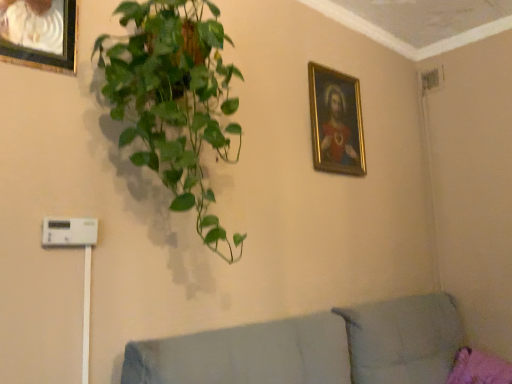
Describe the element at coordinates (39, 34) in the screenshot. I see `brushed metal picture frame at upper left, which appears as the first picture frame when viewed from the front` at that location.

What are the coordinates of `brushed metal picture frame at upper left, which appears as the first picture frame when viewed from the front` in the screenshot? It's located at (39, 34).

Measure the distance between gold-framed painting at upper right, acting as the second picture frame starting from the front, and camera.

They are 2.07 meters apart.

The width and height of the screenshot is (512, 384). Describe the element at coordinates (69, 232) in the screenshot. I see `white plastic light switch at lower left` at that location.

At what (x,y) coordinates should I click in order to perform the action: click on white plastic light switch at lower left. Please return your answer as a coordinate pair (x, y). Image resolution: width=512 pixels, height=384 pixels. Looking at the image, I should click on (69, 232).

You are a GUI agent. You are given a task and a screenshot of the screen. Output one action in this format:
    pyautogui.click(x=<x>, y=<y>)
    Task: Click on the brushed metal picture frame at upper left, which ranks as the second picture frame in back-to-front order
    
    Given the screenshot: What is the action you would take?
    pyautogui.click(x=39, y=34)

Is light gray fabric couch at lower right at the back of white plastic light switch at lower left?

No, white plastic light switch at lower left is not facing the opposite direction of light gray fabric couch at lower right.

Based on their sizes in the image, would you say white plastic light switch at lower left is bigger or smaller than light gray fabric couch at lower right?

In the image, white plastic light switch at lower left appears to be smaller than light gray fabric couch at lower right.

Can you confirm if white plastic light switch at lower left is positioned to the left of light gray fabric couch at lower right?

Yes, white plastic light switch at lower left is to the left of light gray fabric couch at lower right.

Looking at this image, is white plastic light switch at lower left directly adjacent to light gray fabric couch at lower right?

No, white plastic light switch at lower left is not with light gray fabric couch at lower right.

Between green glossy plant at upper left and brushed metal picture frame at upper left, which ranks as the second picture frame in back-to-front order, which one is positioned behind?

brushed metal picture frame at upper left, which ranks as the second picture frame in back-to-front order, is more distant.

Is green glossy plant at upper left aimed at brushed metal picture frame at upper left, which ranks as the second picture frame in back-to-front order?

No, green glossy plant at upper left is not aimed at brushed metal picture frame at upper left, which ranks as the second picture frame in back-to-front order.

From a real-world perspective, which object stands above the other?

brushed metal picture frame at upper left, positioned as the second picture frame in right-to-left order.

From the image's perspective, is brushed metal picture frame at upper left, which appears as the first picture frame when viewed from the left, on light gray fabric couch at lower right?

Correct, brushed metal picture frame at upper left, which appears as the first picture frame when viewed from the left, appears higher than light gray fabric couch at lower right in the image.

Which of these two, brushed metal picture frame at upper left, which appears as the first picture frame when viewed from the front, or light gray fabric couch at lower right, is bigger?

With larger size is light gray fabric couch at lower right.

Where is `studio couch located below the brushed metal picture frame at upper left, which appears as the first picture frame when viewed from the front (from the image's perspective)`? studio couch located below the brushed metal picture frame at upper left, which appears as the first picture frame when viewed from the front (from the image's perspective) is located at coordinates (323, 349).

From a real-world perspective, does brushed metal picture frame at upper left, positioned as the second picture frame in right-to-left order, sit lower than light gray fabric couch at lower right?

No, from a real-world perspective, brushed metal picture frame at upper left, positioned as the second picture frame in right-to-left order, is not below light gray fabric couch at lower right.

Which of these two, brushed metal picture frame at upper left, which appears as the first picture frame when viewed from the front, or white plastic light switch at lower left, stands taller?

brushed metal picture frame at upper left, which appears as the first picture frame when viewed from the front.

Does brushed metal picture frame at upper left, which appears as the first picture frame when viewed from the front, appear on the right side of white plastic light switch at lower left?

No.

How much distance is there between brushed metal picture frame at upper left, positioned as the second picture frame in right-to-left order, and white plastic light switch at lower left?

21.84 inches.

Based on the photo, from a real-world perspective, is brushed metal picture frame at upper left, positioned as the second picture frame in right-to-left order, under white plastic light switch at lower left?

No.

Find the location of `studio couch lying in front of the white plastic light switch at lower left`. studio couch lying in front of the white plastic light switch at lower left is located at coordinates (323, 349).

From a real-world perspective, which object rests below the other?

In real-world perspective, light gray fabric couch at lower right is lower.

Considering the sizes of objects light gray fabric couch at lower right and white plastic light switch at lower left in the image provided, who is thinner, light gray fabric couch at lower right or white plastic light switch at lower left?

With smaller width is white plastic light switch at lower left.

Between light gray fabric couch at lower right and white plastic light switch at lower left, which one appears on the right side from the viewer's perspective?

Positioned to the right is light gray fabric couch at lower right.

Based on their positions, is white plastic light switch at lower left located to the left or right of gold-framed painting at upper right, the first picture frame in the right-to-left sequence?

In the image, white plastic light switch at lower left appears on the left side of gold-framed painting at upper right, the first picture frame in the right-to-left sequence.

Measure the distance from white plastic light switch at lower left to gold-framed painting at upper right, which is the 2th picture frame from left to right.

white plastic light switch at lower left is 4.38 feet away from gold-framed painting at upper right, which is the 2th picture frame from left to right.

Is point (92, 242) closer to viewer compared to point (316, 74)?

Yes, point (92, 242) is in front of point (316, 74).

Can you see white plastic light switch at lower left touching gold-framed painting at upper right, the first picture frame when ordered from back to front?

No, white plastic light switch at lower left is not touching gold-framed painting at upper right, the first picture frame when ordered from back to front.

Is white plastic light switch at lower left to the left of brushed metal picture frame at upper left, which appears as the first picture frame when viewed from the front, from the viewer's perspective?

Incorrect, white plastic light switch at lower left is not on the left side of brushed metal picture frame at upper left, which appears as the first picture frame when viewed from the front.

Is white plastic light switch at lower left located outside brushed metal picture frame at upper left, which appears as the first picture frame when viewed from the left?

Indeed, white plastic light switch at lower left is completely outside brushed metal picture frame at upper left, which appears as the first picture frame when viewed from the left.

Is white plastic light switch at lower left oriented towards brushed metal picture frame at upper left, which appears as the first picture frame when viewed from the front?

No, white plastic light switch at lower left is not aimed at brushed metal picture frame at upper left, which appears as the first picture frame when viewed from the front.

Is the depth of white plastic light switch at lower left less than that of brushed metal picture frame at upper left, positioned as the second picture frame in right-to-left order?

No, it is not.

The image size is (512, 384). Identify the location of studio couch in front of the white plastic light switch at lower left. (323, 349).

From a real-world perspective, count 2nd picture frames upward from the green glossy plant at upper left and point to it. Please provide its 2D coordinates.

[(39, 34)]

Considering their positions, is light gray fabric couch at lower right positioned further to gold-framed painting at upper right, acting as the second picture frame starting from the front, than white plastic light switch at lower left?

white plastic light switch at lower left lies further to gold-framed painting at upper right, acting as the second picture frame starting from the front, than the other object.

Considering their positions, is brushed metal picture frame at upper left, which ranks as the second picture frame in back-to-front order, positioned further to white plastic light switch at lower left than green glossy plant at upper left?

brushed metal picture frame at upper left, which ranks as the second picture frame in back-to-front order, lies further to white plastic light switch at lower left than the other object.

Looking at the image, which one is located closer to white plastic light switch at lower left, brushed metal picture frame at upper left, which ranks as the second picture frame in back-to-front order, or gold-framed painting at upper right, which is the 2th picture frame from left to right?

brushed metal picture frame at upper left, which ranks as the second picture frame in back-to-front order.

Estimate the real-world distances between objects in this image. Which object is closer to white plastic light switch at lower left, light gray fabric couch at lower right or green glossy plant at upper left?

green glossy plant at upper left is closer to white plastic light switch at lower left.

Considering their positions, is brushed metal picture frame at upper left, positioned as the second picture frame in right-to-left order, positioned closer to gold-framed painting at upper right, the first picture frame in the right-to-left sequence, than green glossy plant at upper left?

green glossy plant at upper left is positioned closer to the anchor gold-framed painting at upper right, the first picture frame in the right-to-left sequence.

From the image, which object appears to be nearer to green glossy plant at upper left, light gray fabric couch at lower right or white plastic light switch at lower left?

white plastic light switch at lower left is positioned closer to the anchor green glossy plant at upper left.

When comparing their distances from gold-framed painting at upper right, the first picture frame in the right-to-left sequence, does green glossy plant at upper left or light gray fabric couch at lower right seem closer?

Based on the image, green glossy plant at upper left appears to be nearer to gold-framed painting at upper right, the first picture frame in the right-to-left sequence.

Looking at the image, which one is located further to light gray fabric couch at lower right, brushed metal picture frame at upper left, which appears as the first picture frame when viewed from the front, or green glossy plant at upper left?

Among the two, brushed metal picture frame at upper left, which appears as the first picture frame when viewed from the front, is located further to light gray fabric couch at lower right.

Identify the location of houseplant located between white plastic light switch at lower left and light gray fabric couch at lower right in the left-right direction. This screenshot has width=512, height=384. (174, 100).

You are a GUI agent. You are given a task and a screenshot of the screen. Output one action in this format:
    pyautogui.click(x=<x>, y=<y>)
    Task: Click on the light switch between light gray fabric couch at lower right and gold-framed painting at upper right, which is the 2th picture frame from left to right, along the z-axis
    
    Given the screenshot: What is the action you would take?
    pyautogui.click(x=69, y=232)

Locate an element on the screen. houseplant between light gray fabric couch at lower right and gold-framed painting at upper right, which is the 2th picture frame from left to right, in the front-back direction is located at coordinates (174, 100).

Where is `light switch located between brushed metal picture frame at upper left, which appears as the first picture frame when viewed from the front, and light gray fabric couch at lower right in the left-right direction`? light switch located between brushed metal picture frame at upper left, which appears as the first picture frame when viewed from the front, and light gray fabric couch at lower right in the left-right direction is located at coordinates (69, 232).